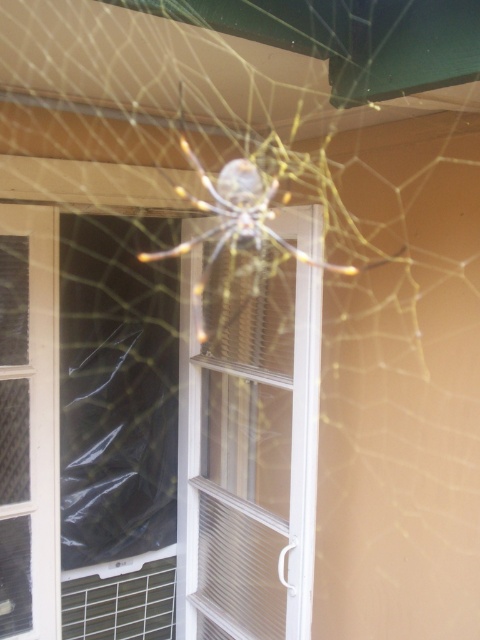
You are a delivery person trying to deliver a package to the address behind the clear plastic screen door at left and the translucent yellow spider at center. You need to know which object is taller to determine the best way to approach. Can you tell me which one is taller?

The clear plastic screen door at left is taller than the translucent yellow spider at center, so you should approach the clear plastic screen door at left first as it is taller and might require more attention for delivery access.

You are a delivery person trying to enter a house through the clear plastic screen door at center or the clear plastic screen door at left. Which door should you choose if you need to carry a large package that requires more space? Please explain your reasoning based on the scene description.

The clear plastic screen door at center has a larger size compared to the clear plastic screen door at left. Therefore, you should choose the clear plastic screen door at center to carry your large package since it provides more space.